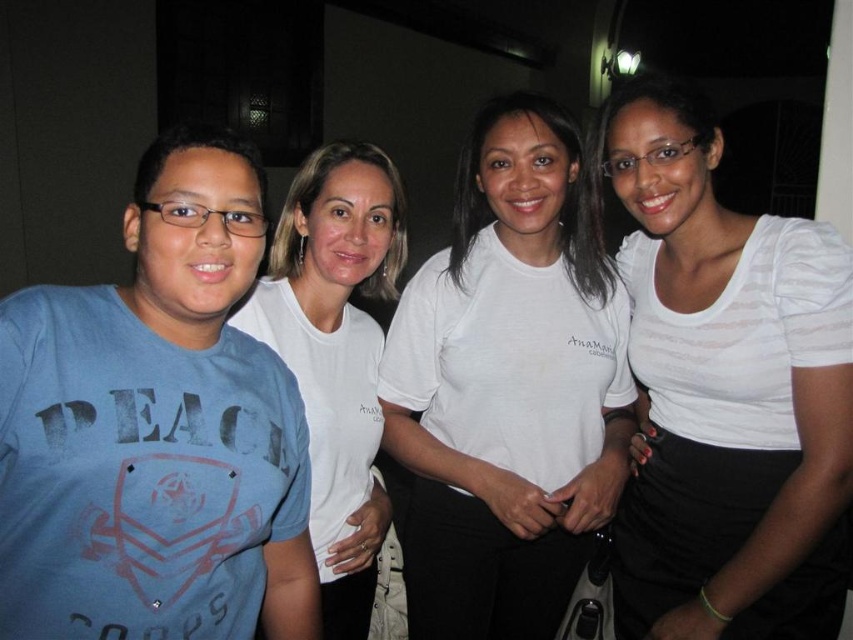
You are a photographer trying to capture a group photo of the four people in the scene. You need to ensure that the white textured shirt at center and the white cotton shirt at center are at least 10 inches apart in the photo. Based on the current arrangement, will you need to adjust their positions?

The distance between the white textured shirt at center and the white cotton shirt at center is 8.66 inches, which is less than the required 10 inches. Therefore, you will need to adjust their positions to increase the distance between them.

You are organizing a clothing donation drive and need to categorize shirts by their thickness. You have two white shirts at the center of the image, one labeled as white textured shirt at center and the other as white cotton shirt at center. Based on the description provided, which shirt should be placed in the section for thinner shirts?

The white textured shirt at center is thinner than the white cotton shirt at center, so it should be placed in the section for thinner shirts.